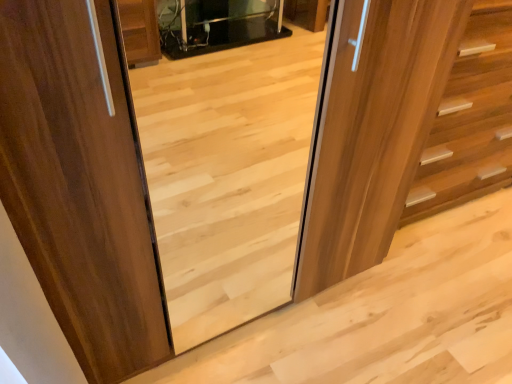
Question: Should I look upward or downward to see wooden door at center?

Choices:
 (A) down
 (B) up

Answer: (B)